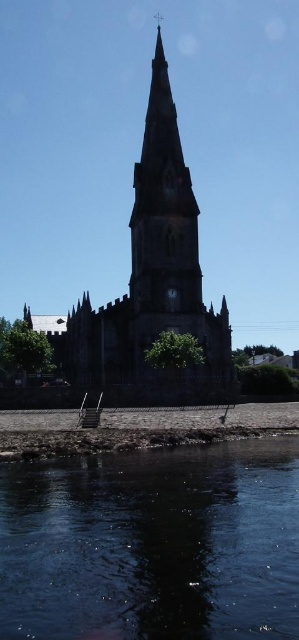
Question: Is smooth stone church at center below metallic silver clock at center?

Choices:
 (A) yes
 (B) no

Answer: (B)

Question: Is smooth stone church at center below metallic silver clock at center?

Choices:
 (A) no
 (B) yes

Answer: (A)

Question: Which object is positioned farthest from the metallic silver clock at center?

Choices:
 (A) smooth stone church at center
 (B) dark blue water at lower center

Answer: (B)

Question: Which of these objects is positioned closest to the smooth stone church at center?

Choices:
 (A) dark blue water at lower center
 (B) metallic silver clock at center

Answer: (B)

Question: Which object is the closest to the metallic silver clock at center?

Choices:
 (A) smooth stone church at center
 (B) dark blue water at lower center

Answer: (A)

Question: Does dark blue water at lower center have a larger size compared to metallic silver clock at center?

Choices:
 (A) yes
 (B) no

Answer: (A)